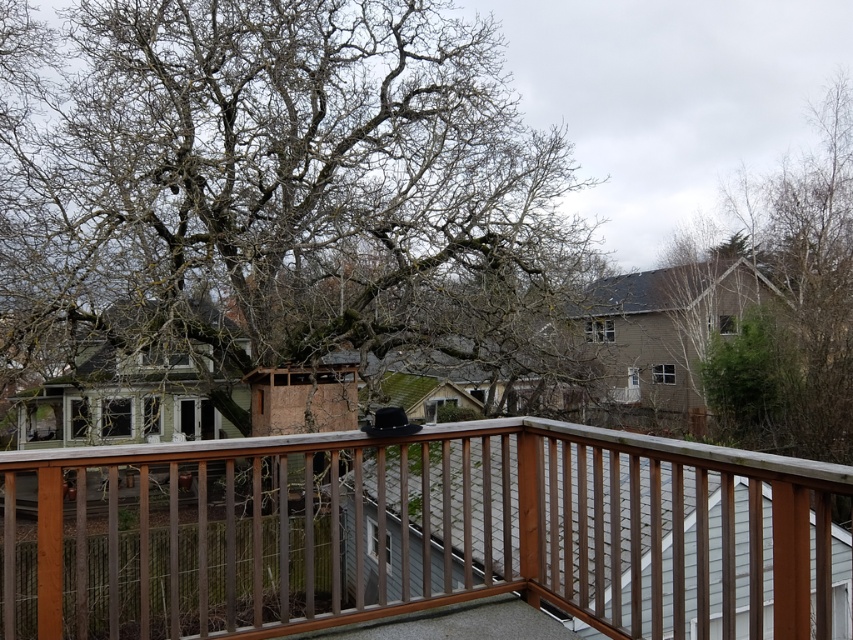
Question: Can you confirm if bare branches at center is bigger than brown wood railing at center?

Choices:
 (A) no
 (B) yes

Answer: (B)

Question: Among these objects, which one is farthest from the camera?

Choices:
 (A) bare branches at center
 (B) brown wood railing at center

Answer: (A)

Question: Is bare branches at center further to camera compared to brown wood railing at center?

Choices:
 (A) no
 (B) yes

Answer: (B)

Question: Among these objects, which one is farthest from the camera?

Choices:
 (A) bare branches at center
 (B) brown wood railing at center

Answer: (A)

Question: Which point appears closest to the camera in this image?

Choices:
 (A) (772, 616)
 (B) (401, 170)

Answer: (A)

Question: Can you confirm if bare branches at center is positioned to the right of brown wood railing at center?

Choices:
 (A) no
 (B) yes

Answer: (A)